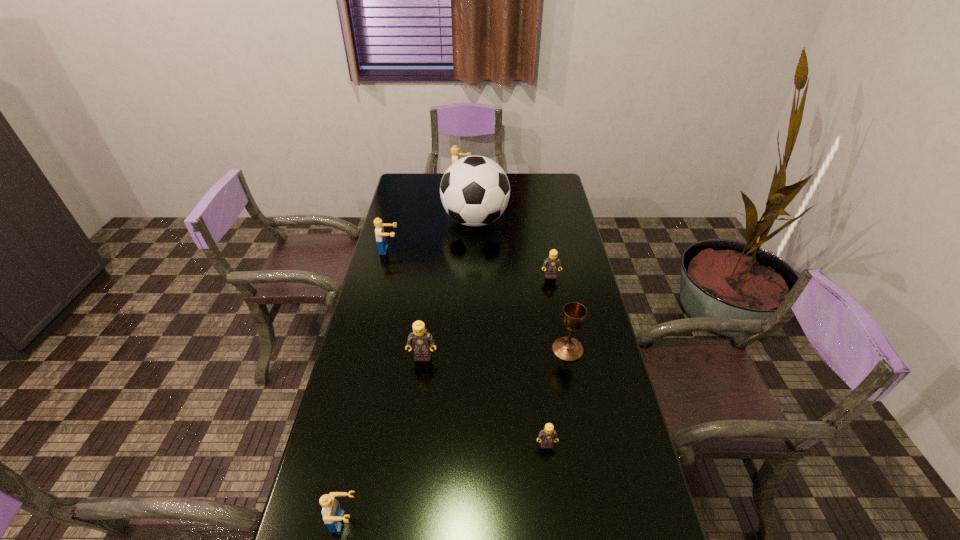
At what (x,y) coordinates should I click in order to perform the action: click on the tallest object. Please return your answer as a coordinate pair (x, y). Image resolution: width=960 pixels, height=540 pixels. Looking at the image, I should click on (474, 190).

The width and height of the screenshot is (960, 540). I want to click on the seventh nearest object, so click(x=474, y=190).

Where is `the rightmost blue Lego`? the rightmost blue Lego is located at coordinates (455, 153).

Where is `the farthest object`? the farthest object is located at coordinates (455, 153).

At what (x,y) coordinates should I click in order to perform the action: click on chalice. Please return your answer as a coordinate pair (x, y). Looking at the image, I should click on (574, 314).

What are the coordinates of `the second smallest blue Lego` in the screenshot? It's located at (379, 230).

I want to click on the second nearest blue Lego, so click(379, 230).

Identify the location of the fourth farthest Lego. The image size is (960, 540). (420, 339).

Image resolution: width=960 pixels, height=540 pixels. Identify the location of the biggest tan Lego. (420, 339).

At what (x,y) coordinates should I click in order to perform the action: click on the nearest blue Lego. Please return your answer as a coordinate pair (x, y). The height and width of the screenshot is (540, 960). Looking at the image, I should click on (332, 514).